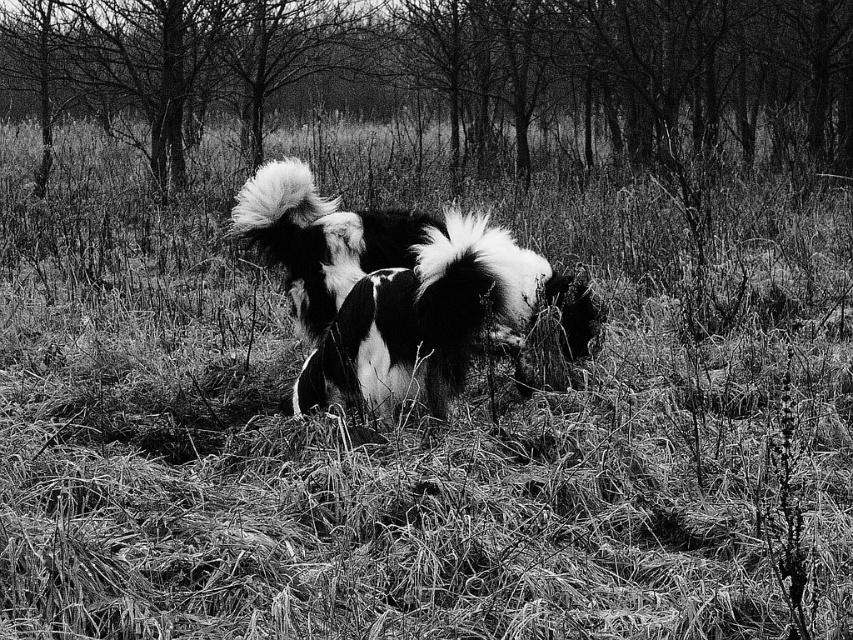
Can you confirm if smooth bark tree at center is smaller than black and white fur dog at center?

No.

Does point (547, 61) lie behind point (297, 192)?

Yes, point (547, 61) is farther from viewer.

Identify the location of smooth bark tree at center. tap(451, 65).